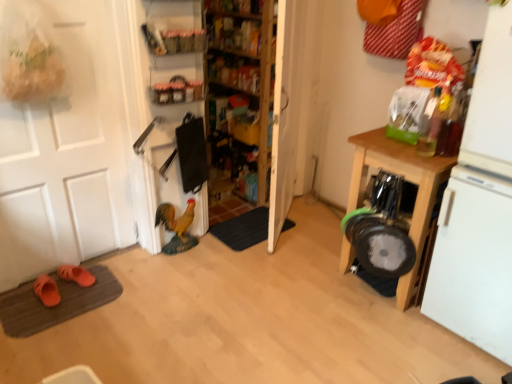
Where is `vacant space situated above dark gray carpet at center, placed as the first doormat when sorted from back to front (from a real-world perspective)`? Image resolution: width=512 pixels, height=384 pixels. vacant space situated above dark gray carpet at center, placed as the first doormat when sorted from back to front (from a real-world perspective) is located at coordinates (248, 229).